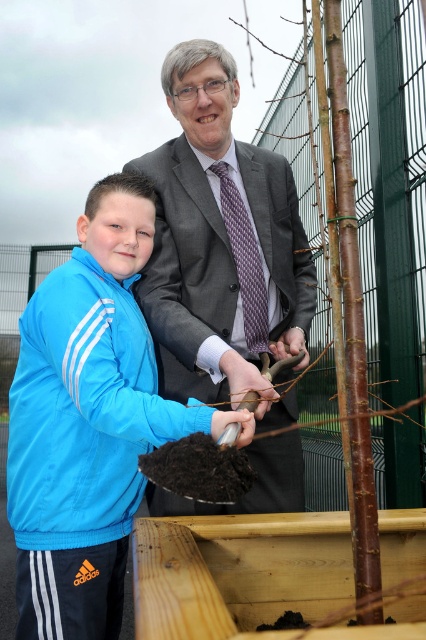
Question: Is blue fabric jacket at left below matte gray suit at center?

Choices:
 (A) yes
 (B) no

Answer: (A)

Question: Does matte gray suit at center have a smaller size compared to white matte shovel at lower center?

Choices:
 (A) yes
 (B) no

Answer: (B)

Question: Estimate the real-world distances between objects in this image. Which object is farther from the blue fabric jacket at left?

Choices:
 (A) matte black glove at center
 (B) purple textured tie at center
 (C) matte gray suit at center

Answer: (B)

Question: Estimate the real-world distances between objects in this image. Which object is farther from the blue fabric jacket at left?

Choices:
 (A) matte gray suit at center
 (B) brown rough bark tree at center
 (C) white matte shovel at lower center

Answer: (B)

Question: Is matte gray suit at center positioned behind purple textured tie at center?

Choices:
 (A) no
 (B) yes

Answer: (A)

Question: Estimate the real-world distances between objects in this image. Which object is closer to the white matte shovel at lower center?

Choices:
 (A) matte gray suit at center
 (B) brown rough bark tree at center
 (C) matte black glove at center
 (D) blue fabric jacket at left

Answer: (C)